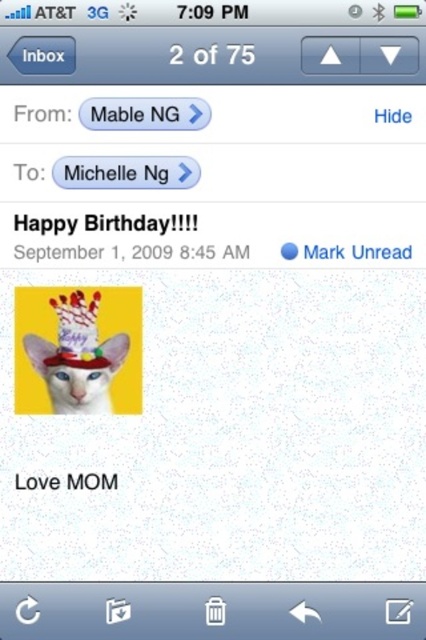
Question: In this image, where is white matte cat at center located relative to white paper text at upper center?

Choices:
 (A) left
 (B) right

Answer: (A)

Question: Among these points, which one is nearest to the camera?

Choices:
 (A) (19, 220)
 (B) (104, 412)

Answer: (A)

Question: Which point is farther from the camera taking this photo?

Choices:
 (A) (149, 224)
 (B) (62, 330)

Answer: (B)

Question: Does white matte cat at center appear over white paper text at upper center?

Choices:
 (A) yes
 (B) no

Answer: (B)

Question: Does white matte cat at center have a larger size compared to white paper text at upper center?

Choices:
 (A) yes
 (B) no

Answer: (B)